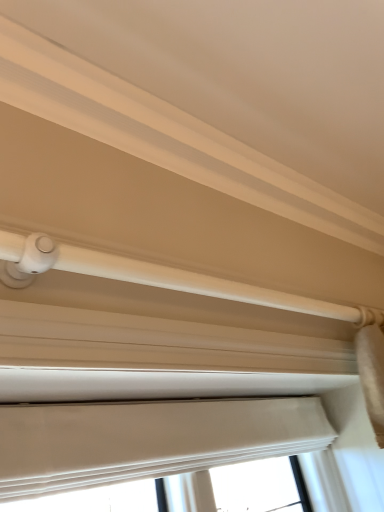
The height and width of the screenshot is (512, 384). Describe the element at coordinates (165, 277) in the screenshot. I see `white matte pipe at upper center` at that location.

The image size is (384, 512). I want to click on white matte pipe at upper center, so tap(165, 277).

Locate an element on the screen. white matte pipe at upper center is located at coordinates (165, 277).